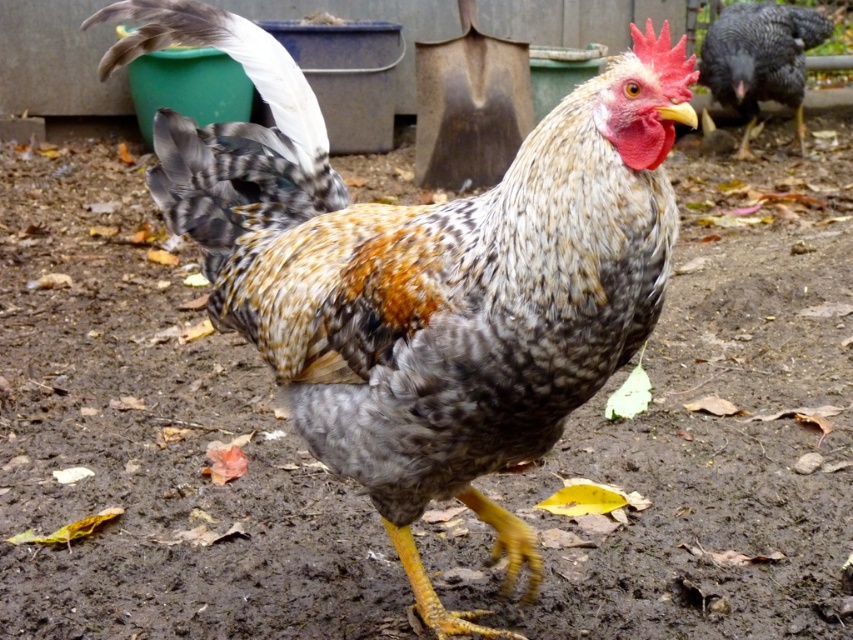
You are a farmer checking on your poultry. You notice two speckled feathered roosters in the scene. Which one is closer to you, the speckled feathered rooster at center or the speckled feathered rooster at upper right?

The speckled feathered rooster at center is closer to you because it is in front of the speckled feathered rooster at upper right.